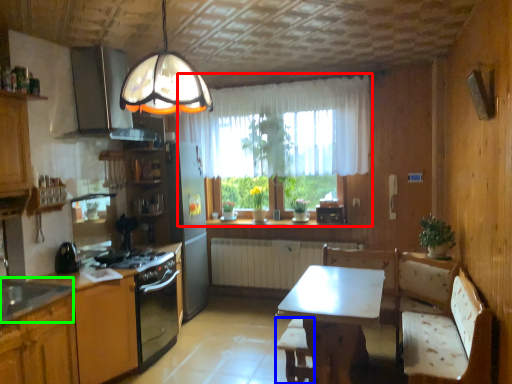
Question: Which object is positioned farthest from window (highlighted by a red box)? Select from bar stool (highlighted by a blue box) and sink (highlighted by a green box).

Choices:
 (A) bar stool
 (B) sink

Answer: (B)